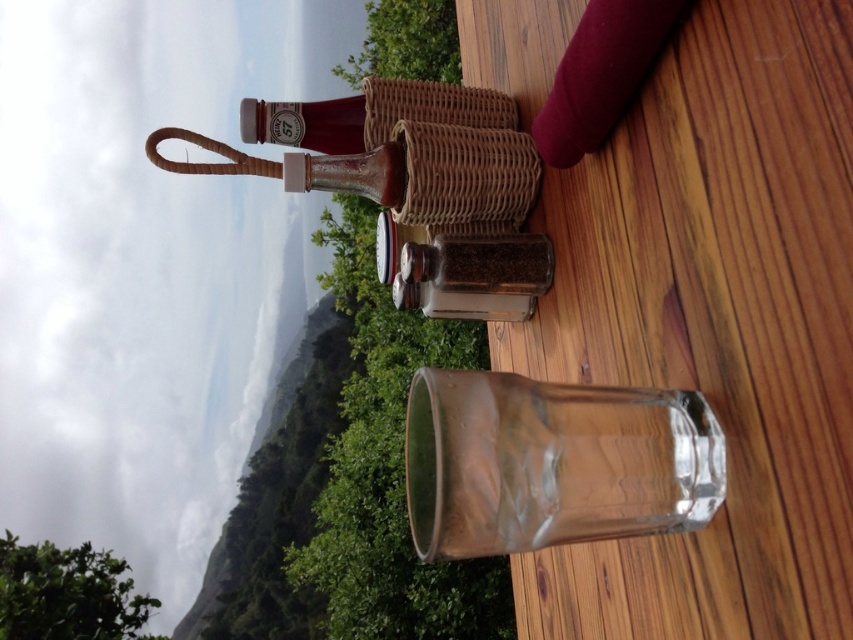
You are a customer at this outdoor table and want to reach both the clear glass shaker at center and the translucent glass bottle at upper center. Which one do you need to move first to make space for your hand?

You should move the clear glass shaker at center first because it is larger and might be blocking access to the translucent glass bottle at upper center.

You are a waiter who needs to place a 12 inch long tray between the transparent glass at center and the clear glass shaker at center on the table. Can you fit the tray between them without moving the existing items?

The transparent glass at center and clear glass shaker at center are 10.97 inches apart from each other. Since the tray is 12 inches long, which is longer than the space between them, the tray cannot be placed between them without moving the existing items.

You are a customer at this outdoor table. You want to pour water from the transparent glass at center into the translucent glass bottle at center. Is this possible based on their sizes?

The transparent glass at center is much taller than the translucent glass bottle at center, so pouring water from the taller glass into the shorter bottle might be possible, but the bottle may not hold all the water due to its smaller size.